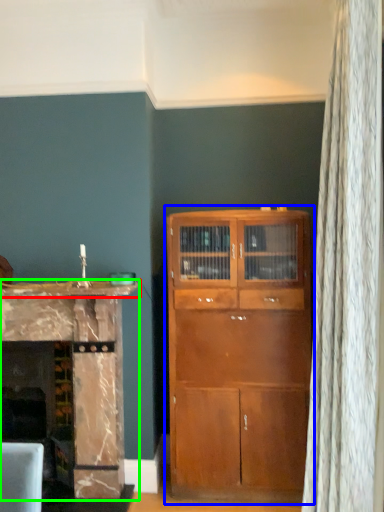
Question: Based on their relative distances, which object is farther from counter top (highlighted by a red box)? Choose from cupboard (highlighted by a blue box) and cabinetry (highlighted by a green box).

Choices:
 (A) cupboard
 (B) cabinetry

Answer: (A)